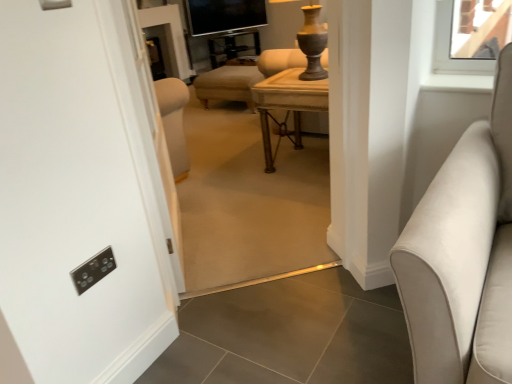
Question: Considering their positions, is wooden table at center located in front of or behind matte beige ottoman at center?

Choices:
 (A) behind
 (B) front

Answer: (A)

Question: Considering the positions of point (287, 107) and point (269, 228), is point (287, 107) closer or farther from the camera than point (269, 228)?

Choices:
 (A) closer
 (B) farther

Answer: (B)

Question: Which object is positioned farthest from the wooden table at center?

Choices:
 (A) matte beige ottoman at center
 (B) suede-like beige sofa at right
 (C) black glass tv at upper center
 (D) metallic gold side table at center

Answer: (D)

Question: Based on their relative distances, which object is nearer to the metallic gold side table at center?

Choices:
 (A) wooden table at center
 (B) matte beige ottoman at center
 (C) black glass tv at upper center
 (D) suede-like beige sofa at right

Answer: (C)